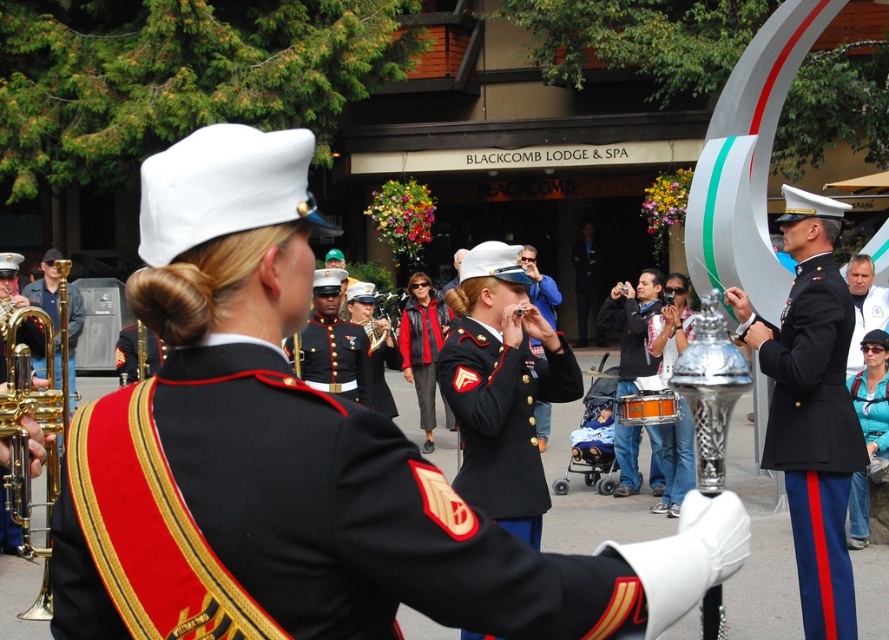
Can you confirm if maroon fabric uniform at center is positioned to the right of shiny black uniform at center?

In fact, maroon fabric uniform at center is to the left of shiny black uniform at center.

The image size is (889, 640). Find the location of `maroon fabric uniform at center`. maroon fabric uniform at center is located at coordinates (335, 356).

Image resolution: width=889 pixels, height=640 pixels. Find the location of `maroon fabric uniform at center`. maroon fabric uniform at center is located at coordinates (335, 356).

Can you confirm if gold brass trumpet at left is positioned below dark blue uniform at center?

Yes.

Which is in front, point (47, 506) or point (851, 348)?

Positioned in front is point (47, 506).

You are a GUI agent. You are given a task and a screenshot of the screen. Output one action in this format:
    pyautogui.click(x=<x>, y=<y>)
    Task: Click on the gold brass trumpet at left
    The height and width of the screenshot is (640, 889).
    Given the screenshot: What is the action you would take?
    pyautogui.click(x=35, y=420)

Is teal fabric jacket at lower right above orange polished wood drum at center?

Actually, teal fabric jacket at lower right is below orange polished wood drum at center.

Which is behind, point (883, 333) or point (623, 403)?

Point (623, 403)

The image size is (889, 640). What do you see at coordinates (871, 392) in the screenshot? I see `teal fabric jacket at lower right` at bounding box center [871, 392].

This screenshot has width=889, height=640. I want to click on teal fabric jacket at lower right, so click(871, 392).